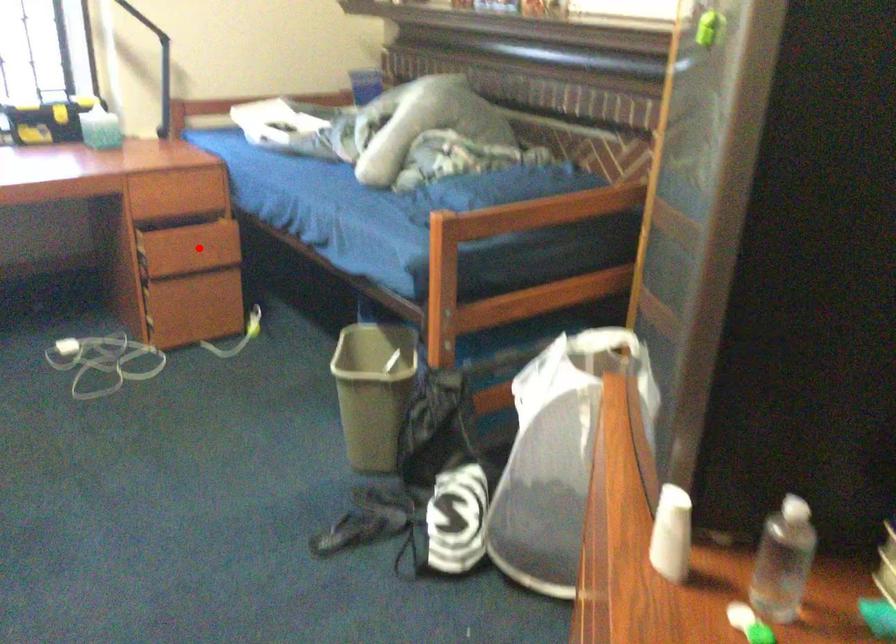
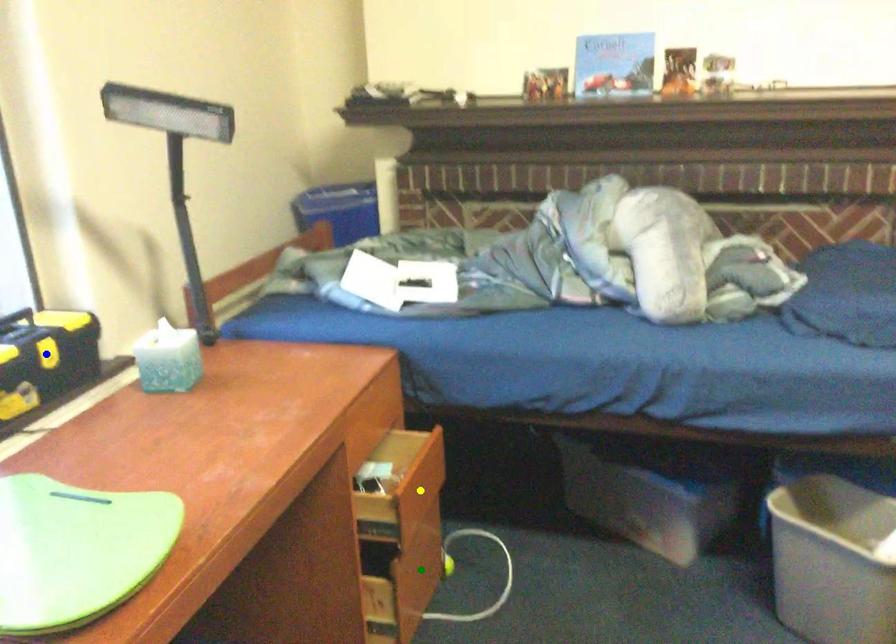
Question: I am providing you with two images of the same scene from different viewpoints. A red point is marked on the first image. You are given multiple points on the second image. Which spot in image 2 lines up with the point in image 1?

Choices:
 (A) yellow point
 (B) blue point
 (C) green point

Answer: (A)